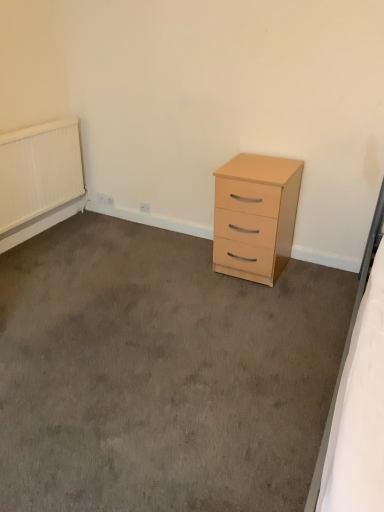
Locate an element on the screen. The image size is (384, 512). free location in front of light wood/finish chest of drawers at center-right is located at coordinates (259, 300).